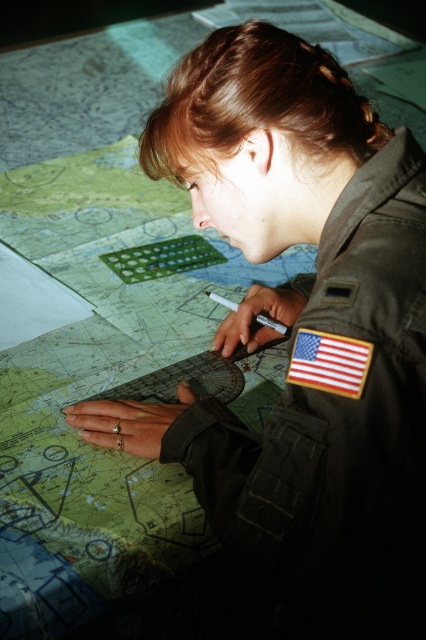
Question: Does brown hair at upper center appear on the left side of american flag patch at upper center?

Choices:
 (A) yes
 (B) no

Answer: (B)

Question: Which point appears closest to the camera in this image?

Choices:
 (A) (314, 81)
 (B) (301, 337)

Answer: (B)

Question: Does brown hair at upper center have a lesser width compared to american flag patch at upper center?

Choices:
 (A) no
 (B) yes

Answer: (A)

Question: Is brown hair at upper center positioned before american flag patch at upper center?

Choices:
 (A) no
 (B) yes

Answer: (A)